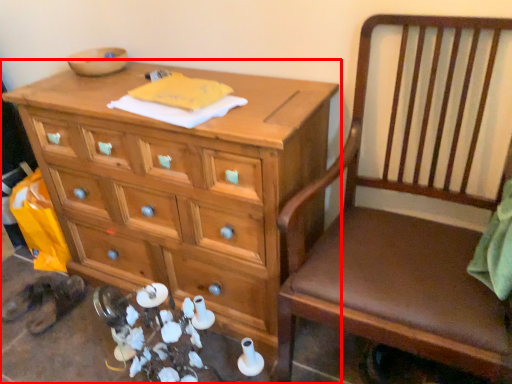
Question: Considering the relative positions of chest of drawers (annotated by the red box) and chair in the image provided, where is chest of drawers (annotated by the red box) located with respect to the staircase?

Choices:
 (A) right
 (B) left

Answer: (B)